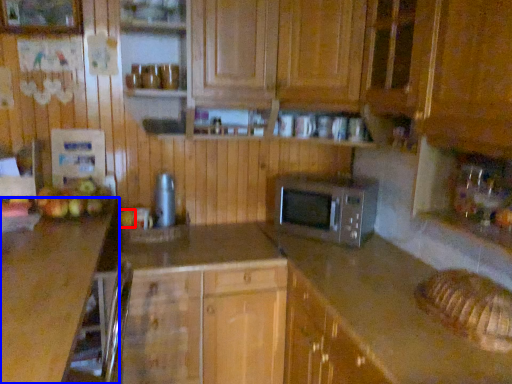
Question: Among these objects, which one is farthest to the camera, apple (highlighted by a red box) or countertop (highlighted by a blue box)?

Choices:
 (A) apple
 (B) countertop

Answer: (A)